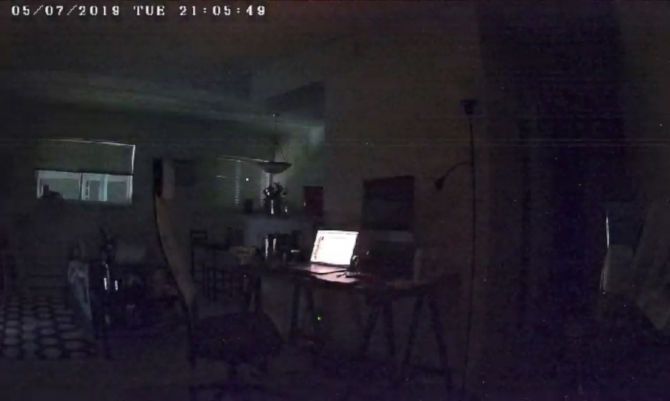
Where is `table legs`? The width and height of the screenshot is (670, 401). table legs is located at coordinates (368, 320), (312, 297), (293, 303).